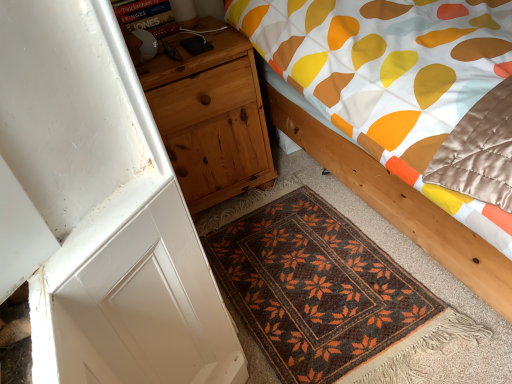
Measure the distance between wooden bed at center and camera.

wooden bed at center is 26.63 inches from camera.

The image size is (512, 384). Describe the element at coordinates (393, 110) in the screenshot. I see `wooden bed at center` at that location.

Where is `brown woven mat at lower center`? brown woven mat at lower center is located at coordinates (326, 295).

Is natural wood nightstand at left surrounding wooden bed at center?

No, wooden bed at center is not surrounded by natural wood nightstand at left.

Who is bigger, natural wood nightstand at left or wooden bed at center?

Bigger between the two is wooden bed at center.

Which object is positioned more to the left, natural wood nightstand at left or wooden bed at center?

Positioned to the left is natural wood nightstand at left.

How different are the orientations of natural wood nightstand at left and wooden bed at center in degrees?

The facing directions of natural wood nightstand at left and wooden bed at center are 0.699 degrees apart.

Could you tell me if natural wood nightstand at left is facing brown woven mat at lower center?

Yes, natural wood nightstand at left is aimed at brown woven mat at lower center.

Is natural wood nightstand at left directly adjacent to brown woven mat at lower center?

No, natural wood nightstand at left is not touching brown woven mat at lower center.

What's the angular difference between natural wood nightstand at left and brown woven mat at lower center's facing directions?

The angle between the facing direction of natural wood nightstand at left and the facing direction of brown woven mat at lower center is 0.89 degrees.

Does natural wood nightstand at left have a greater width compared to brown woven mat at lower center?

No, natural wood nightstand at left is not wider than brown woven mat at lower center.

Who is bigger, brown woven mat at lower center or natural wood nightstand at left?

natural wood nightstand at left is bigger.

Would you say brown woven mat at lower center is inside or outside natural wood nightstand at left?

brown woven mat at lower center is not enclosed by natural wood nightstand at left.

From a real-world perspective, which is physically below, brown woven mat at lower center or natural wood nightstand at left?

brown woven mat at lower center is physically lower.

From the image's perspective, is brown woven mat at lower center on natural wood nightstand at left?

Incorrect, from the image's perspective, brown woven mat at lower center is lower than natural wood nightstand at left.

Does wooden bed at center have a greater width compared to natural wood nightstand at left?

Indeed, wooden bed at center has a greater width compared to natural wood nightstand at left.

Is wooden bed at center smaller than natural wood nightstand at left?

No.

Is wooden bed at center closer to camera compared to natural wood nightstand at left?

Yes, wooden bed at center is closer to the camera.

Is wooden bed at center shorter than brown woven mat at lower center?

Incorrect, the height of wooden bed at center does not fall short of that of brown woven mat at lower center.

Considering the positions of objects wooden bed at center and brown woven mat at lower center in the image provided, who is more to the right, wooden bed at center or brown woven mat at lower center?

Positioned to the right is wooden bed at center.

From the image's perspective, would you say wooden bed at center is shown under brown woven mat at lower center?

Incorrect, from the image's perspective, wooden bed at center is higher than brown woven mat at lower center.

Which is correct: wooden bed at center is inside brown woven mat at lower center, or outside of it?

wooden bed at center lies outside brown woven mat at lower center.

Based on their sizes in the image, would you say brown woven mat at lower center is bigger or smaller than wooden bed at center?

brown woven mat at lower center is smaller than wooden bed at center.

Does brown woven mat at lower center contain wooden bed at center?

No, brown woven mat at lower center does not contain wooden bed at center.

Is brown woven mat at lower center taller or shorter than wooden bed at center?

brown woven mat at lower center is shorter than wooden bed at center.

This screenshot has width=512, height=384. Identify the location of bed above the natural wood nightstand at left (from a real-world perspective). (393, 110).

The image size is (512, 384). I want to click on mat on the right of natural wood nightstand at left, so click(326, 295).

Based on their spatial positions, is natural wood nightstand at left or wooden bed at center further from brown woven mat at lower center?

natural wood nightstand at left lies further to brown woven mat at lower center than the other object.

Based on their spatial positions, is brown woven mat at lower center or wooden bed at center closer to natural wood nightstand at left?

Among the two, wooden bed at center is located nearer to natural wood nightstand at left.

From the image, which object appears to be farther from wooden bed at center, natural wood nightstand at left or brown woven mat at lower center?

brown woven mat at lower center lies further to wooden bed at center than the other object.

When comparing their distances from brown woven mat at lower center, does wooden bed at center or natural wood nightstand at left seem closer?

wooden bed at center.

When comparing their distances from natural wood nightstand at left, does wooden bed at center or brown woven mat at lower center seem closer?

The object closer to natural wood nightstand at left is wooden bed at center.

Considering their positions, is brown woven mat at lower center positioned further to wooden bed at center than natural wood nightstand at left?

Among the two, brown woven mat at lower center is located further to wooden bed at center.

Image resolution: width=512 pixels, height=384 pixels. In order to click on mat between natural wood nightstand at left and wooden bed at center from left to right in this screenshot , I will do coord(326,295).